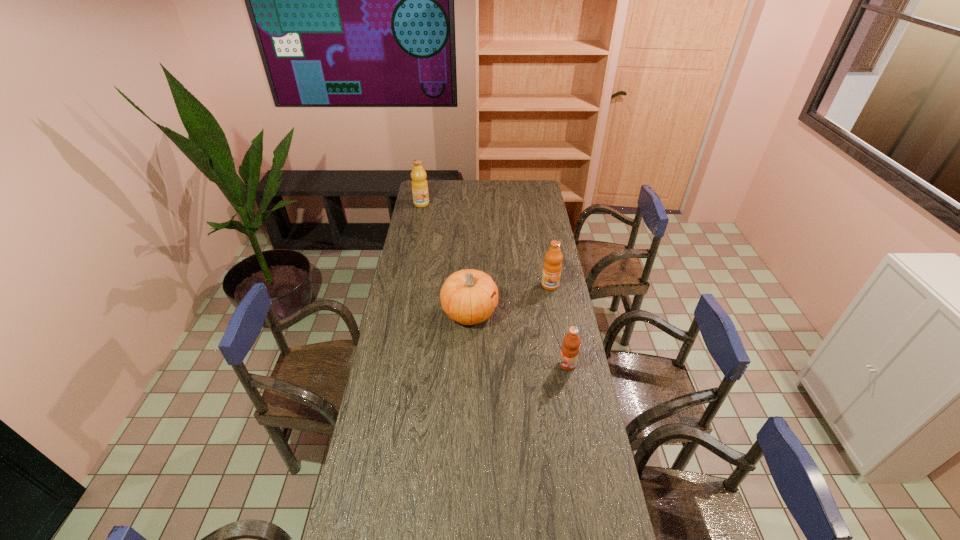
Locate an element on the screen. The width and height of the screenshot is (960, 540). the farthest fruit juice is located at coordinates (419, 183).

Locate an element on the screen. Image resolution: width=960 pixels, height=540 pixels. the farthest object is located at coordinates (419, 183).

Locate an element on the screen. the second farthest object is located at coordinates (552, 267).

Locate an element on the screen. pumpkin is located at coordinates (465, 296).

You are a GUI agent. You are given a task and a screenshot of the screen. Output one action in this format:
    pyautogui.click(x=<x>, y=<y>)
    Task: Click on the third farthest object
    The image size is (960, 540).
    Given the screenshot: What is the action you would take?
    pyautogui.click(x=465, y=296)

In order to click on the shortest object in this screenshot , I will do `click(570, 348)`.

The height and width of the screenshot is (540, 960). In order to click on the nearest object in this screenshot , I will do `click(570, 348)`.

This screenshot has width=960, height=540. Identify the location of vacant space situated 0.260m on the front label of the leftmost fruit juice. (416, 234).

The height and width of the screenshot is (540, 960). I want to click on vacant region located 0.290m on the label side of the second nearest fruit juice, so click(560, 339).

The height and width of the screenshot is (540, 960). I want to click on vacant space located on the front-facing side of the third farthest object, so click(x=534, y=313).